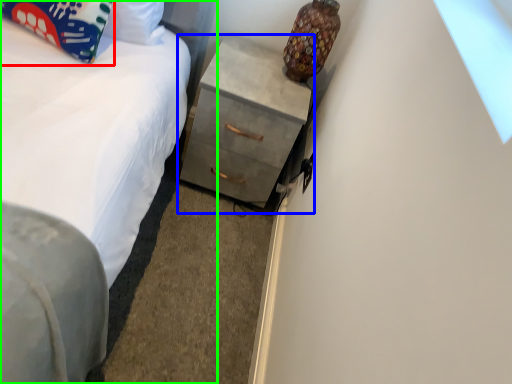
Question: Which object is positioned closest to pillow (highlighted by a red box)? Select from chest of drawers (highlighted by a blue box) and bed (highlighted by a green box).

Choices:
 (A) chest of drawers
 (B) bed

Answer: (B)